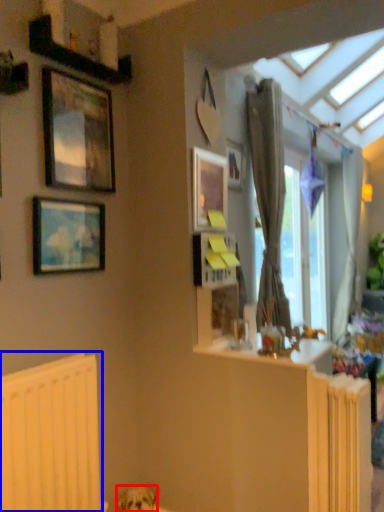
Question: Which of the following is the farthest to the observer, dog (highlighted by a red box) or radiator (highlighted by a blue box)?

Choices:
 (A) dog
 (B) radiator

Answer: (A)